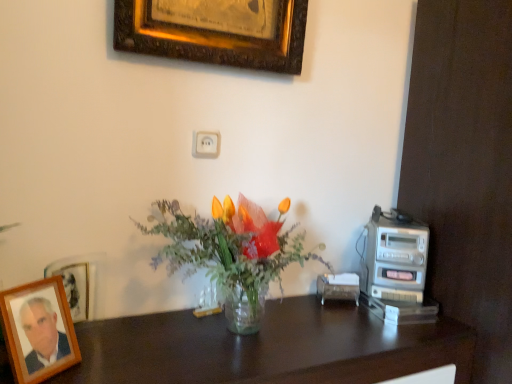
Locate an element on the screen. Image resolution: width=512 pixels, height=384 pixels. wooden photo frame at lower left, acting as the first picture frame starting from the front is located at coordinates coord(38,330).

What do you see at coordinates (267, 348) in the screenshot? I see `dark wood desk at center` at bounding box center [267, 348].

What is the approximate width of transparent glass vase at center?

transparent glass vase at center is 36.49 centimeters in width.

The image size is (512, 384). Find the location of `gold-framed picture at upper center, the first picture frame positioned from the right`. gold-framed picture at upper center, the first picture frame positioned from the right is located at coordinates (216, 31).

Is transparent glass vase at center positioned in front of wooden photo frame at lower left, which is the second picture frame in back-to-front order?

No, it is not.

From the image's perspective, is transparent glass vase at center on top of wooden photo frame at lower left, which is the first picture frame from bottom to top?

Correct, transparent glass vase at center appears higher than wooden photo frame at lower left, which is the first picture frame from bottom to top, in the image.

In terms of width, does transparent glass vase at center look wider or thinner when compared to wooden photo frame at lower left, acting as the 1th picture frame starting from the left?

transparent glass vase at center is wider than wooden photo frame at lower left, acting as the 1th picture frame starting from the left.

Would you say transparent glass vase at center is inside or outside wooden photo frame at lower left, which is the second picture frame in back-to-front order?

transparent glass vase at center cannot be found inside wooden photo frame at lower left, which is the second picture frame in back-to-front order.

Which is more to the right, white plastic outlet at upper center or gold-framed picture at upper center, which is counted as the 2th picture frame, starting from the bottom?

Positioned to the right is gold-framed picture at upper center, which is counted as the 2th picture frame, starting from the bottom.

Looking at this image, from a real-world perspective, is white plastic outlet at upper center positioned under gold-framed picture at upper center, which appears as the second picture frame when viewed from the left, based on gravity?

Yes, from a real-world perspective, white plastic outlet at upper center is under gold-framed picture at upper center, which appears as the second picture frame when viewed from the left.

Which is in front, white plastic outlet at upper center or gold-framed picture at upper center, which appears as the second picture frame when viewed from the left?

gold-framed picture at upper center, which appears as the second picture frame when viewed from the left, is more forward.

Which point is more forward, (244, 297) or (288, 310)?

Point (244, 297)

From the image's perspective, who appears lower, transparent glass vase at center or dark wood desk at center?

dark wood desk at center, from the image's perspective.

From a real-world perspective, is transparent glass vase at center physically located above or below dark wood desk at center?

transparent glass vase at center is situated higher than dark wood desk at center in the real world.

Which is behind, transparent glass vase at center or dark wood desk at center?

transparent glass vase at center.

From the image's perspective, is gold-framed picture at upper center, which is counted as the 2th picture frame, starting from the bottom, located above or below silver metallic stereo at right?

Based on their image positions, gold-framed picture at upper center, which is counted as the 2th picture frame, starting from the bottom, is located above silver metallic stereo at right.

Is gold-framed picture at upper center, which ranks as the second picture frame in front-to-back order, facing towards silver metallic stereo at right?

No, gold-framed picture at upper center, which ranks as the second picture frame in front-to-back order, is not turned towards silver metallic stereo at right.

Is gold-framed picture at upper center, which ranks as the second picture frame in front-to-back order, wider or thinner than silver metallic stereo at right?

gold-framed picture at upper center, which ranks as the second picture frame in front-to-back order, is thinner than silver metallic stereo at right.

Locate an element on the screen. The image size is (512, 384). appliance to the right of gold-framed picture at upper center, which is counted as the 2th picture frame, starting from the bottom is located at coordinates (395, 257).

Is dark wood desk at center aimed at transparent glass vase at center?

No, dark wood desk at center is not turned towards transparent glass vase at center.

Is dark wood desk at center wider than transparent glass vase at center?

Indeed, dark wood desk at center has a greater width compared to transparent glass vase at center.

Who is shorter, dark wood desk at center or transparent glass vase at center?

Standing shorter between the two is transparent glass vase at center.

Is dark wood desk at center completely or partially outside of transparent glass vase at center?

Absolutely, dark wood desk at center is external to transparent glass vase at center.

In the image, is gold-framed picture at upper center, which is counted as the 2th picture frame, starting from the bottom, positioned in front of or behind dark wood desk at center?

gold-framed picture at upper center, which is counted as the 2th picture frame, starting from the bottom, is behind dark wood desk at center.

Identify the location of the 2nd picture frame located above the dark wood desk at center (from a real-world perspective). (216, 31).

Considering the positions of objects gold-framed picture at upper center, the first picture frame viewed from the back, and dark wood desk at center in the image provided, who is more to the left, gold-framed picture at upper center, the first picture frame viewed from the back, or dark wood desk at center?

Positioned to the left is gold-framed picture at upper center, the first picture frame viewed from the back.

Does point (201, 23) come in front of point (312, 344)?

No.

Is gold-framed picture at upper center, which ranks as the second picture frame in front-to-back order, inside wooden photo frame at lower left, acting as the 1th picture frame starting from the left?

Definitely not — gold-framed picture at upper center, which ranks as the second picture frame in front-to-back order, is not inside wooden photo frame at lower left, acting as the 1th picture frame starting from the left.

Can you confirm if wooden photo frame at lower left, acting as the first picture frame starting from the front, is shorter than gold-framed picture at upper center, which appears as the second picture frame when viewed from the left?

Correct, wooden photo frame at lower left, acting as the first picture frame starting from the front, is not as tall as gold-framed picture at upper center, which appears as the second picture frame when viewed from the left.

What's the angular difference between wooden photo frame at lower left, acting as the 1th picture frame starting from the left, and gold-framed picture at upper center, the first picture frame in the top-to-bottom sequence,'s facing directions?

36.7 degrees.

From a real-world perspective, which object stands above the other?

gold-framed picture at upper center, the first picture frame positioned from the right, is physically above.

You are a GUI agent. You are given a task and a screenshot of the screen. Output one action in this format:
    pyautogui.click(x=<x>, y=<y>)
    Task: Click on the 2nd picture frame to the left when counting from the transparent glass vase at center
    This screenshot has width=512, height=384.
    Given the screenshot: What is the action you would take?
    pyautogui.click(x=38, y=330)

Locate an element on the screen. electric outlet that appears below the gold-framed picture at upper center, which appears as the second picture frame when viewed from the left (from the image's perspective) is located at coordinates tap(205, 144).

Which object lies nearer to the anchor point white plastic outlet at upper center, dark wood desk at center or gold-framed picture at upper center, which appears as the second picture frame when viewed from the left?

Based on the image, gold-framed picture at upper center, which appears as the second picture frame when viewed from the left, appears to be nearer to white plastic outlet at upper center.

From the image, which object appears to be nearer to wooden photo frame at lower left, acting as the 1th picture frame starting from the left, gold-framed picture at upper center, the first picture frame positioned from the right, or silver metallic stereo at right?

Among the two, gold-framed picture at upper center, the first picture frame positioned from the right, is located nearer to wooden photo frame at lower left, acting as the 1th picture frame starting from the left.

Looking at this image, estimate the real-world distances between objects in this image. Which object is further from white plastic outlet at upper center, dark wood desk at center or wooden photo frame at lower left, which is the first picture frame from bottom to top?

Among the two, dark wood desk at center is located further to white plastic outlet at upper center.

Estimate the real-world distances between objects in this image. Which object is further from wooden photo frame at lower left, the second picture frame in the right-to-left sequence, dark wood desk at center or silver metallic stereo at right?

silver metallic stereo at right is further to wooden photo frame at lower left, the second picture frame in the right-to-left sequence.

In the scene shown: From the image, which object appears to be farther from white plastic outlet at upper center, gold-framed picture at upper center, the first picture frame positioned from the right, or dark wood desk at center?

The object further to white plastic outlet at upper center is dark wood desk at center.

Estimate the real-world distances between objects in this image. Which object is closer to transparent glass vase at center, gold-framed picture at upper center, which ranks as the second picture frame in front-to-back order, or dark wood desk at center?

The object closer to transparent glass vase at center is dark wood desk at center.

Considering their positions, is gold-framed picture at upper center, the first picture frame positioned from the right, positioned further to transparent glass vase at center than white plastic outlet at upper center?

gold-framed picture at upper center, the first picture frame positioned from the right, lies further to transparent glass vase at center than the other object.

Considering their positions, is dark wood desk at center positioned closer to white plastic outlet at upper center than silver metallic stereo at right?

dark wood desk at center lies closer to white plastic outlet at upper center than the other object.

At what (x,y) coordinates should I click in order to perform the action: click on appliance between white plastic outlet at upper center and dark wood desk at center in the vertical direction. Please return your answer as a coordinate pair (x, y). Looking at the image, I should click on (395, 257).

Where is `flower that lies between white plastic outlet at upper center and wooden photo frame at lower left, the second picture frame in the top-to-bottom sequence, from top to bottom`? This screenshot has width=512, height=384. flower that lies between white plastic outlet at upper center and wooden photo frame at lower left, the second picture frame in the top-to-bottom sequence, from top to bottom is located at coordinates (229, 255).

This screenshot has width=512, height=384. I want to click on electric outlet between gold-framed picture at upper center, which ranks as the second picture frame in front-to-back order, and wooden photo frame at lower left, the second picture frame in the top-to-bottom sequence, in the vertical direction, so click(x=205, y=144).

The width and height of the screenshot is (512, 384). Find the location of `picture frame between gold-framed picture at upper center, which ranks as the second picture frame in front-to-back order, and dark wood desk at center, in the vertical direction`. picture frame between gold-framed picture at upper center, which ranks as the second picture frame in front-to-back order, and dark wood desk at center, in the vertical direction is located at coordinates (38, 330).